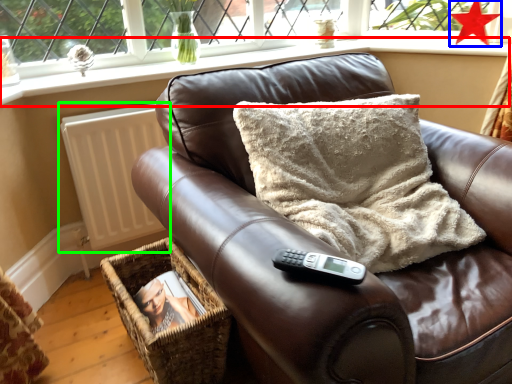
Question: Which object is the closest to the window sill (highlighted by a red box)? Choose among these: star (highlighted by a blue box) or radiator (highlighted by a green box).

Choices:
 (A) star
 (B) radiator

Answer: (B)